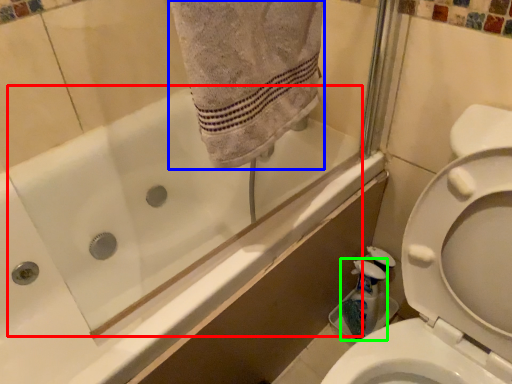
Question: Based on their relative distances, which object is farther from bath (highlighted by a red box)? Choose from bath towel (highlighted by a blue box) and cleaning product (highlighted by a green box).

Choices:
 (A) bath towel
 (B) cleaning product

Answer: (A)